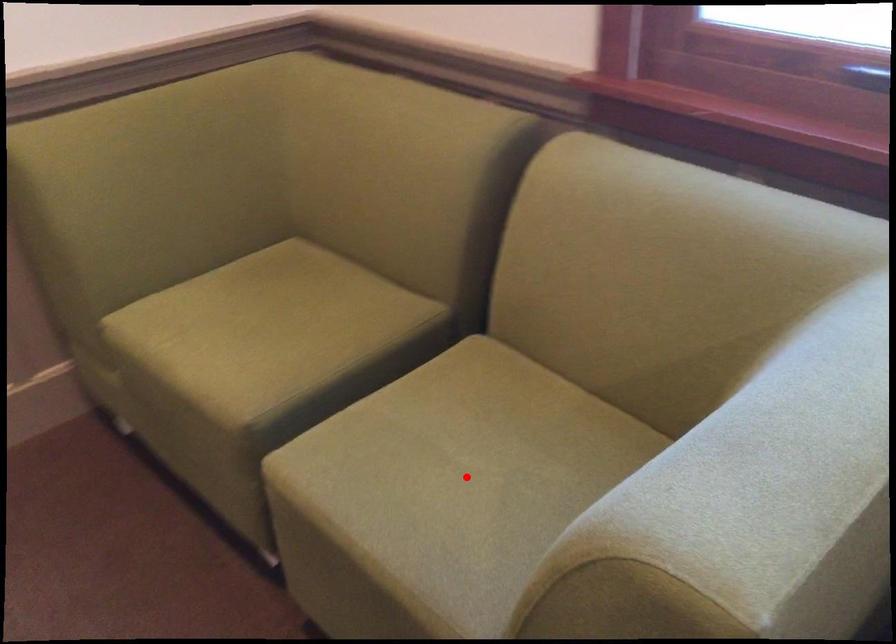
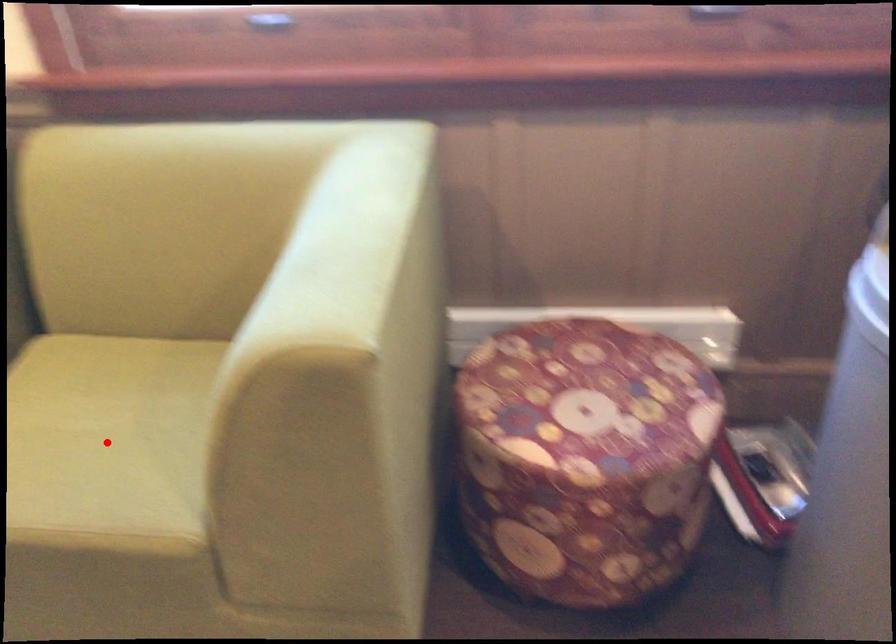
I am providing you with two images of the same scene from different viewpoints. A red point is marked on the first image and another point is marked on the second image. Does the point marked in image1 correspond to the same location as the one in image2?

Yes